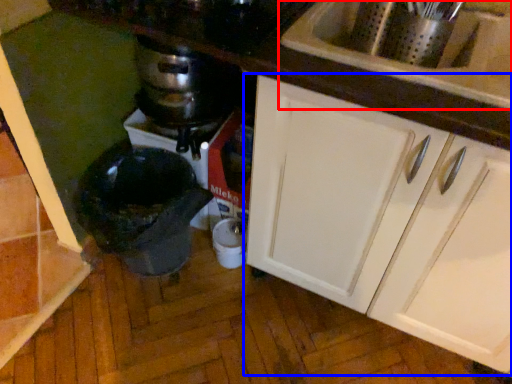
Question: Which point is further to the camera, sink (highlighted by a red box) or cabinetry (highlighted by a blue box)?

Choices:
 (A) sink
 (B) cabinetry

Answer: (A)